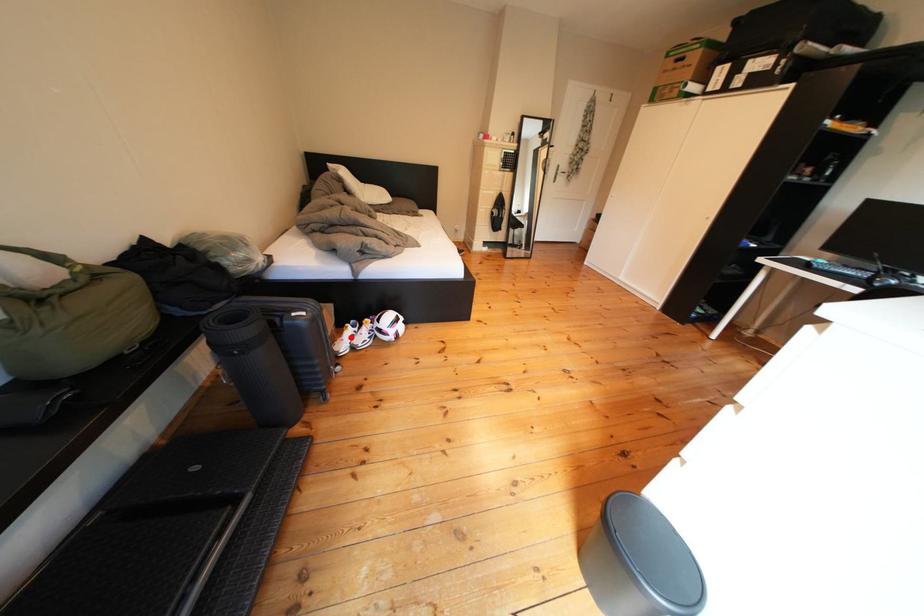
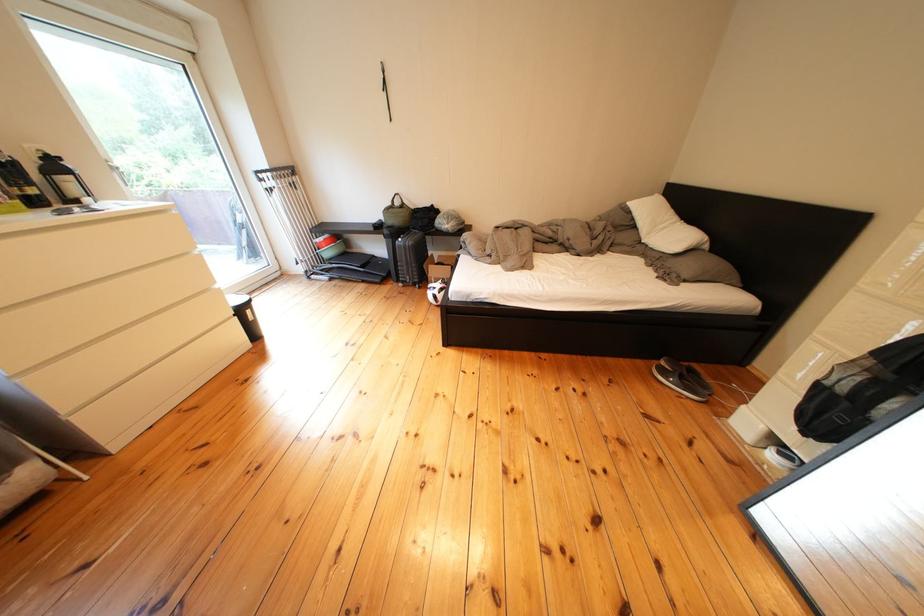
Question: I am providing you with two images of the same scene from different viewpoints. A red point is marked on the first image. Can you still see the location of the red point in image 2?

Choices:
 (A) Yes
 (B) No

Answer: (B)